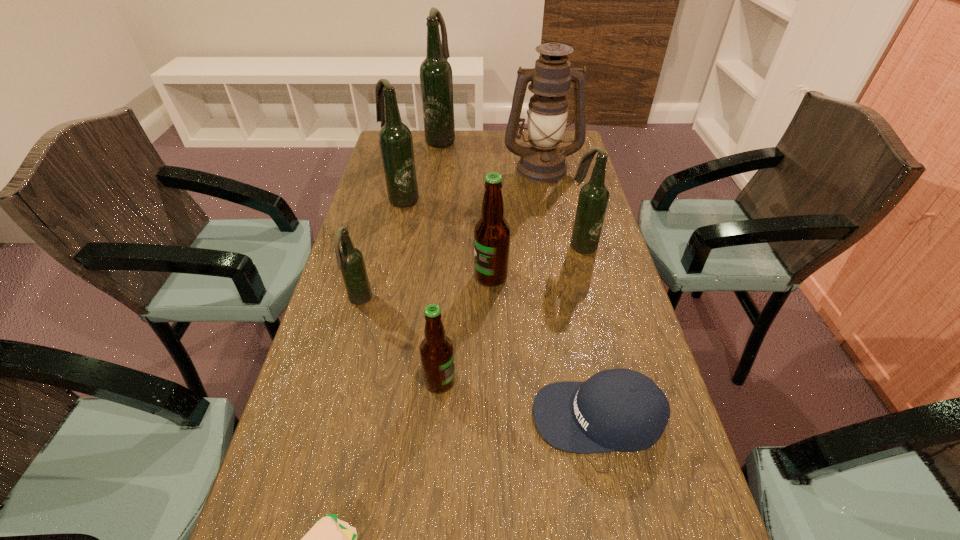
At what (x,y) coordinates should I click in order to perform the action: click on the nearest beer bottle. Please return your answer as a coordinate pair (x, y). The height and width of the screenshot is (540, 960). Looking at the image, I should click on (436, 350).

Locate an element on the screen. This screenshot has height=540, width=960. the smaller brown beer bottle is located at coordinates (436, 350).

The height and width of the screenshot is (540, 960). Find the location of `the smallest dark beer bottle`. the smallest dark beer bottle is located at coordinates (350, 261).

Identify the location of the nearest dark beer bottle. The image size is (960, 540). (350, 261).

Locate an element on the screen. The height and width of the screenshot is (540, 960). blue baseball cap is located at coordinates (624, 410).

Where is `the eighth tallest object`? The image size is (960, 540). the eighth tallest object is located at coordinates (624, 410).

This screenshot has width=960, height=540. Identify the location of free location located on the right of the farthest dark beer bottle. (496, 139).

The height and width of the screenshot is (540, 960). I want to click on free space located on the left of the blue oil lamp, so click(x=393, y=168).

Where is `vacant space located 0.220m on the back of the seventh nearest object`? This screenshot has height=540, width=960. vacant space located 0.220m on the back of the seventh nearest object is located at coordinates [x=412, y=156].

I want to click on free space located on the label of the bigger brown beer bottle, so click(x=402, y=276).